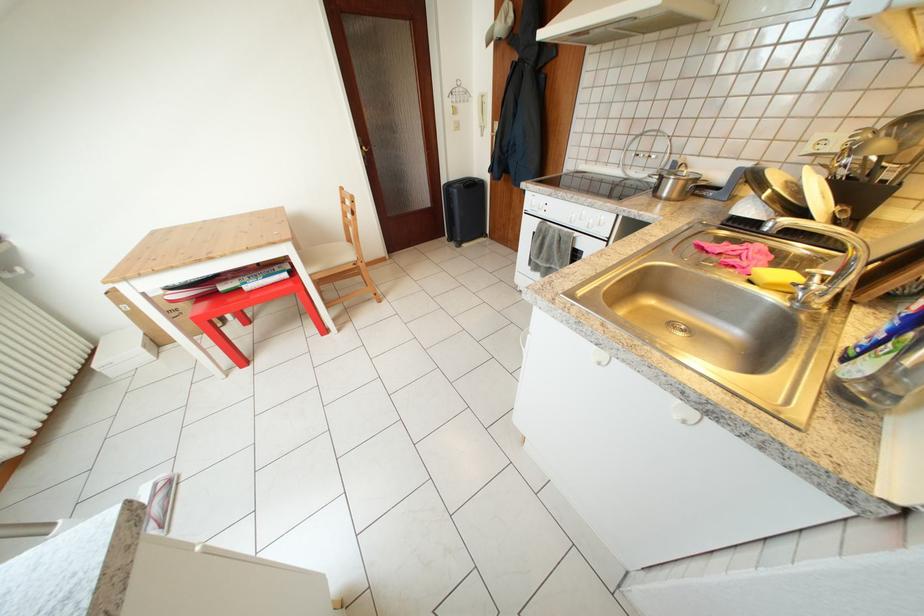
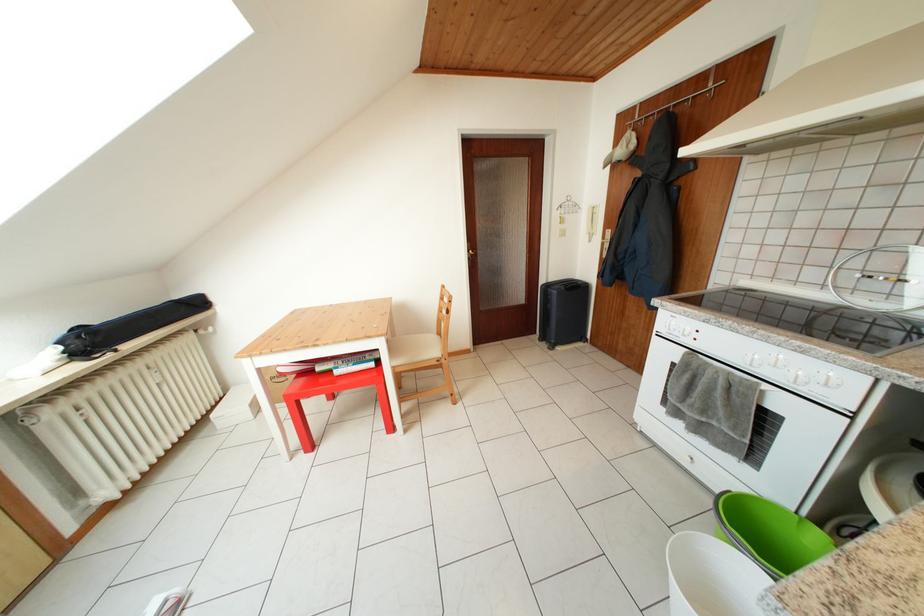
Find the pixel in the second image that matches the point at 247,294 in the first image.

(338, 377)